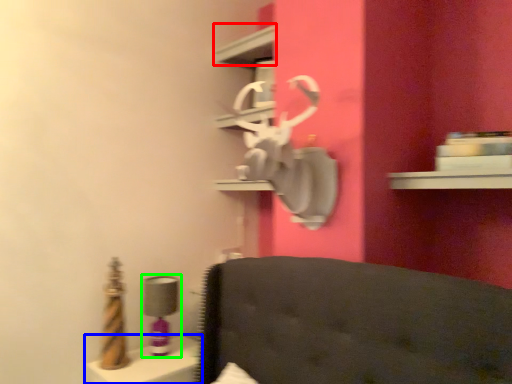
Question: Which object is positioned farthest from shelf (highlighted by a red box)? Select from vanity (highlighted by a blue box) and table lamp (highlighted by a green box).

Choices:
 (A) vanity
 (B) table lamp

Answer: (A)